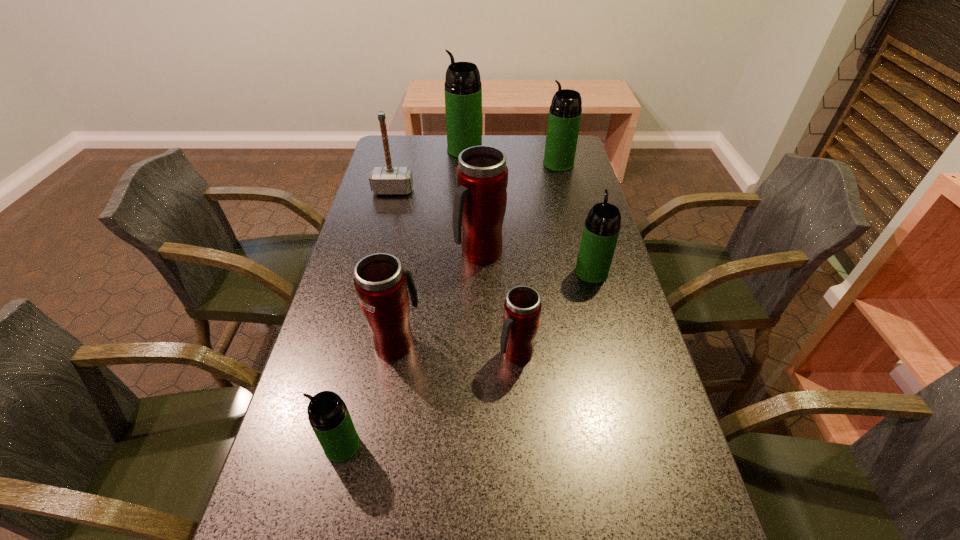
At what (x,y) coordinates should I click in order to perform the action: click on the tallest object. Please return your answer as a coordinate pair (x, y). Image resolution: width=960 pixels, height=540 pixels. Looking at the image, I should click on (463, 90).

Image resolution: width=960 pixels, height=540 pixels. Identify the location of the tallest thermos bottle. (463, 90).

You are a GUI agent. You are given a task and a screenshot of the screen. Output one action in this format:
    pyautogui.click(x=<x>, y=<y>)
    Task: Click on the third smallest green thermos bottle
    
    Given the screenshot: What is the action you would take?
    pyautogui.click(x=565, y=112)

Identify the location of the biggest red thermos bottle. (480, 200).

In order to click on hammer in this screenshot , I will do [x=383, y=180].

In order to click on the third farthest object in this screenshot , I will do `click(383, 180)`.

I want to click on the third farthest green thermos bottle, so click(602, 226).

This screenshot has width=960, height=540. Find the location of `the second smallest red thermos bottle`. the second smallest red thermos bottle is located at coordinates (380, 281).

The width and height of the screenshot is (960, 540). What are the coordinates of `the smallest red thermos bottle` in the screenshot? It's located at (522, 308).

At what (x,y) coordinates should I click in order to perform the action: click on the nearest thermos bottle. Please return your answer as a coordinate pair (x, y). Looking at the image, I should click on (328, 415).